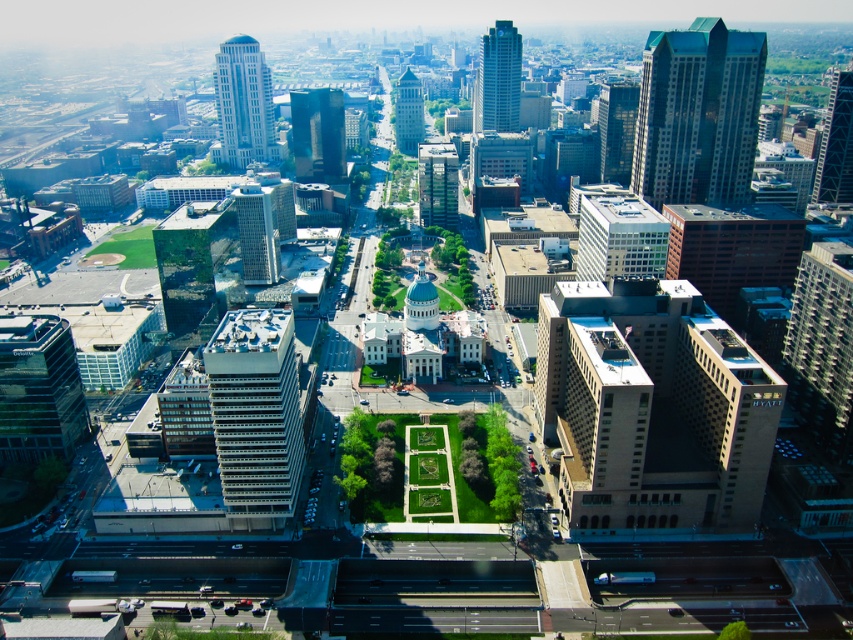
Question: Among these points, which one is farthest from the camera?

Choices:
 (A) (498, 100)
 (B) (305, 154)

Answer: (A)

Question: Does glassy reflective skyscraper at center-left have a lesser width compared to glassy reflective skyscraper at center-right?

Choices:
 (A) no
 (B) yes

Answer: (B)

Question: Is beige concrete building at center-right positioned at the back of glassy reflective skyscraper at upper center?

Choices:
 (A) no
 (B) yes

Answer: (A)

Question: Among these points, which one is nearest to the camera?

Choices:
 (A) (630, 118)
 (B) (511, 83)
 (C) (824, 176)
 (D) (601, 262)

Answer: (D)

Question: Which point is farther to the camera?

Choices:
 (A) (693, 172)
 (B) (637, 83)

Answer: (B)

Question: Is shiny glass skyscraper at upper left below glassy reflective skyscraper at center?

Choices:
 (A) yes
 (B) no

Answer: (B)